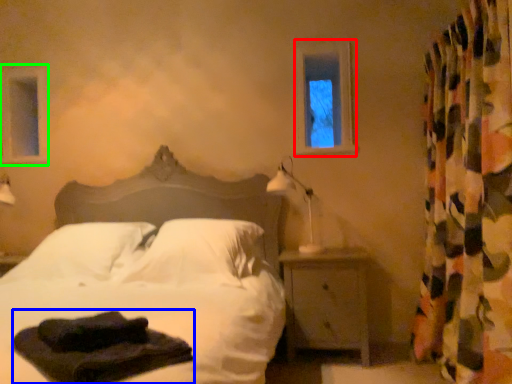
Question: Estimate the real-world distances between objects in this image. Which object is closer to window frame (highlighted by a red box), material (highlighted by a blue box) or window frame (highlighted by a green box)?

Choices:
 (A) material
 (B) window frame

Answer: (A)